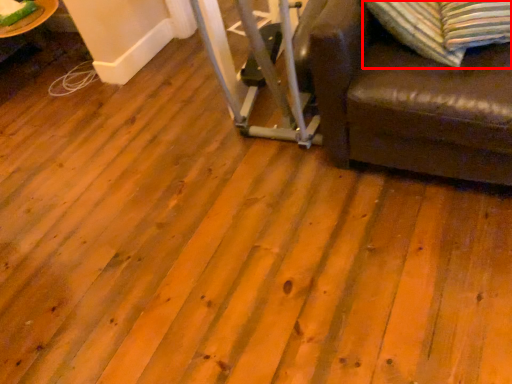
Question: From the image's perspective, where is pillow (annotated by the red box) located in relation to table in the image?

Choices:
 (A) below
 (B) above

Answer: (A)